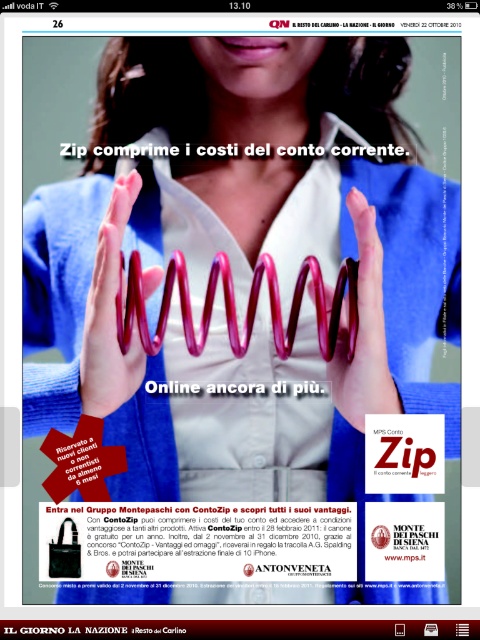
Looking at this image, you are designing a layout for a promotional ad and need to ensure that the matte red spiral spring at center and the white matte text at center are clearly visible. Based on their sizes, which object should you adjust to make sure they are both easily readable from a distance?

The matte red spiral spring at center is thinner than the white matte text at center, so you should adjust the matte red spiral spring at center to be thicker to ensure readability from a distance.

You are holding a ruler and want to measure the distance from the camera to the matte pink spiral at center. According to the information provided, what is the exact distance?

The exact distance from the camera to the matte pink spiral at center is 30.61 inches.

In the scene shown: You are trying to locate the matte pink spiral at center on the page of Il Giorno magazine. According to the coordinates provided, where exactly is it positioned?

The matte pink spiral at center is positioned at the coordinates point (109, 314).